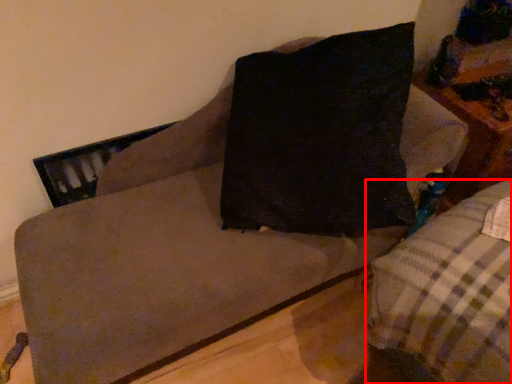
Question: From the image's perspective, where is studio couch (annotated by the red box) located relative to table?

Choices:
 (A) below
 (B) above

Answer: (A)